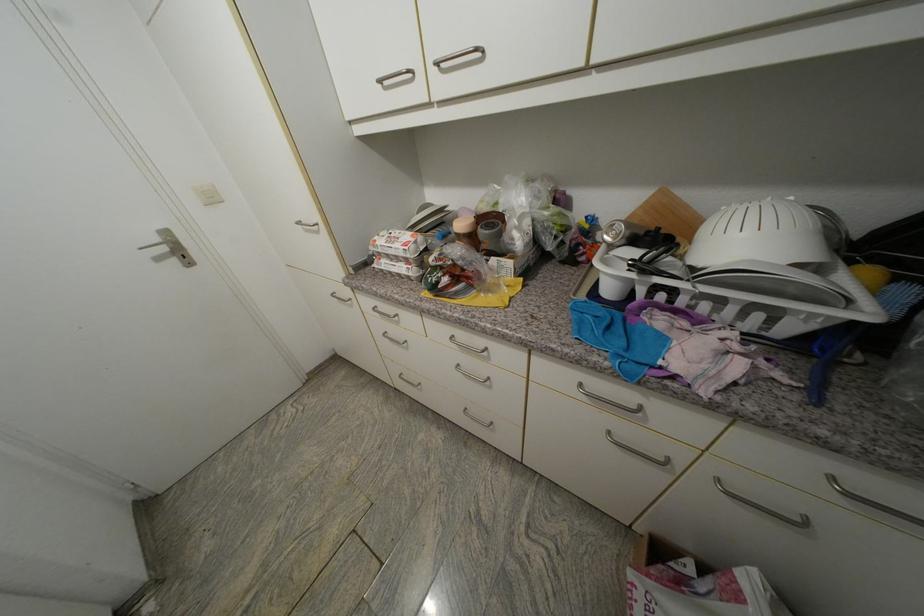
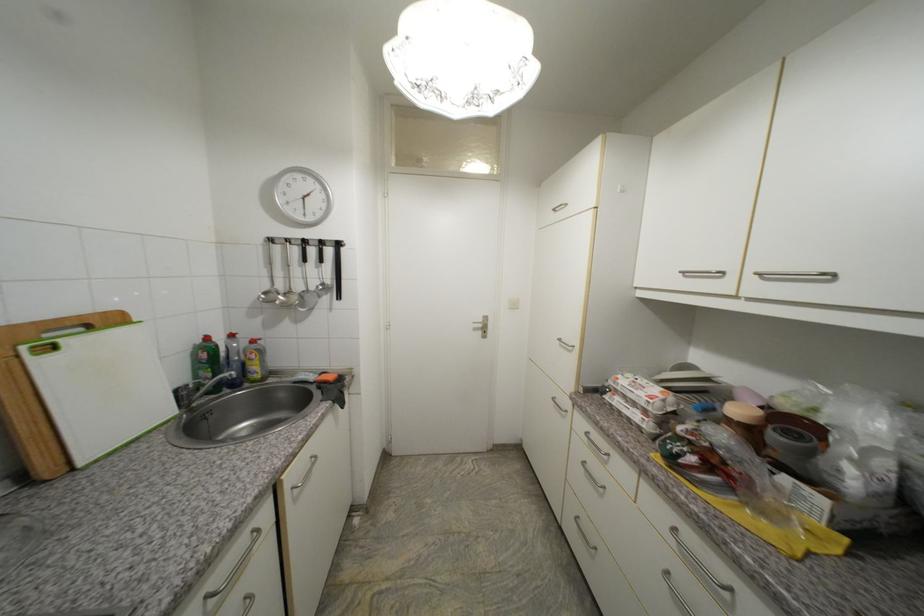
The point at (164,243) is marked in the first image. Where is the corresponding point in the second image?

(487, 322)